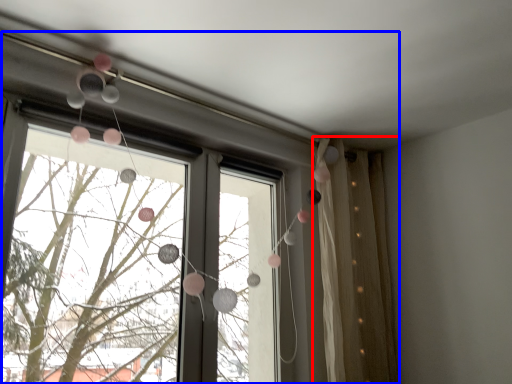
Question: Which of the following is the closest to the observer, curtain (highlighted by a red box) or window (highlighted by a blue box)?

Choices:
 (A) curtain
 (B) window

Answer: (B)